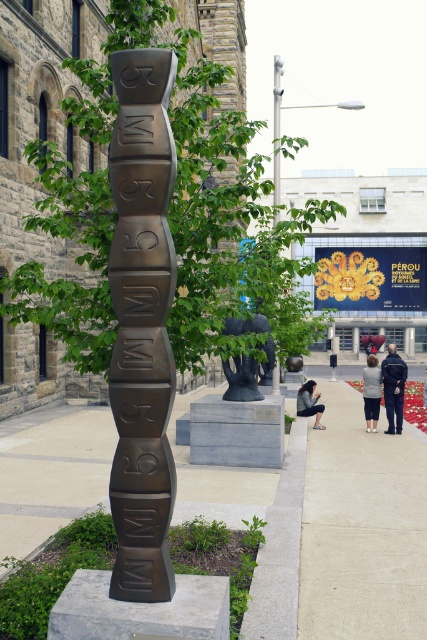
You are a visitor at the museum and you see the black matte sculpture at center and the denim jacket at lower right. Which object is closer to you?

The denim jacket at lower right is closer to you because the black matte sculpture at center is positioned over it, indicating it is further away.